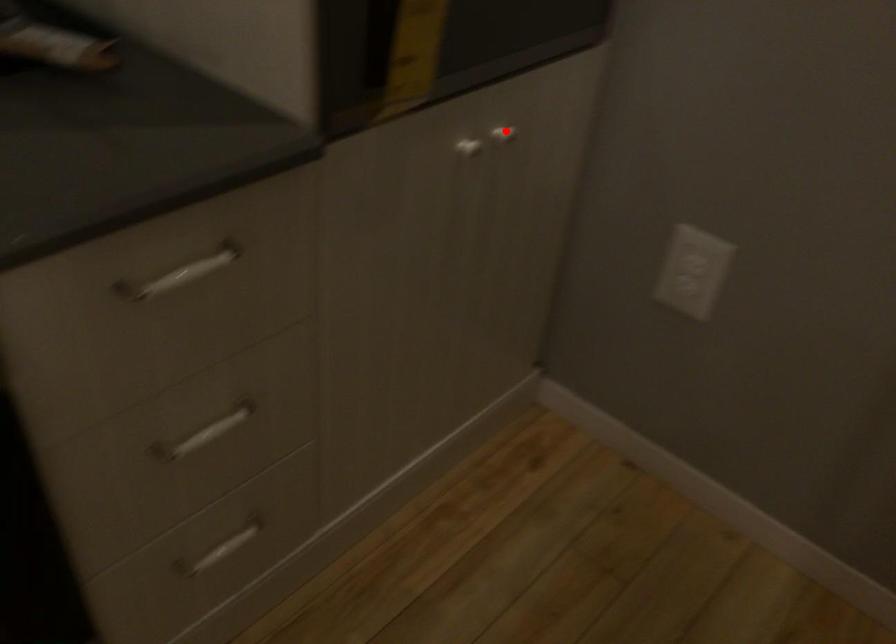
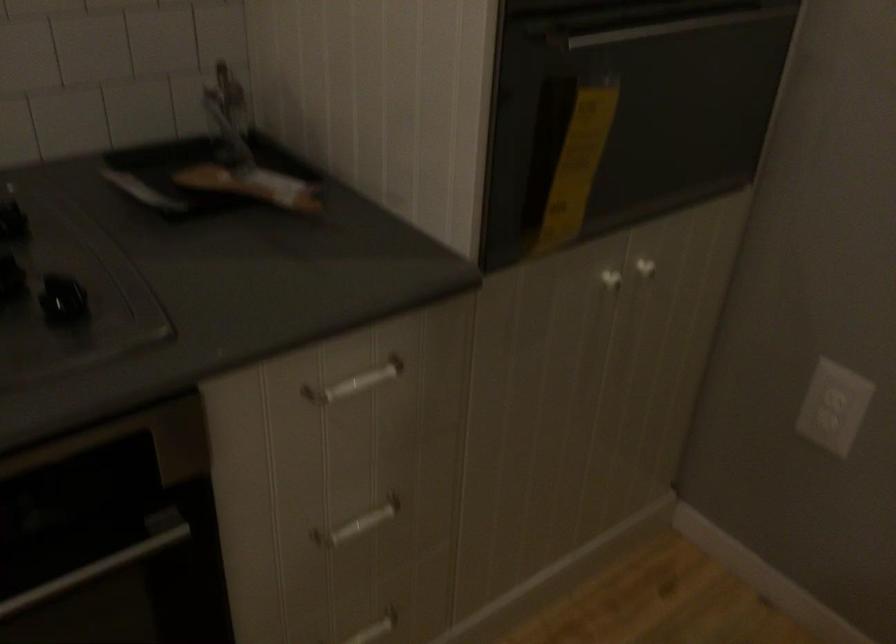
The point at the highlighted location is marked in the first image. Where is the corresponding point in the second image?

(645, 268)